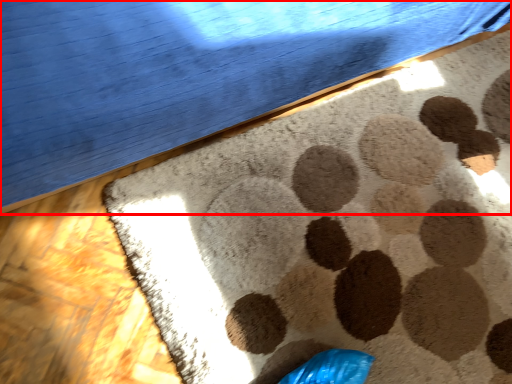
Question: Considering the relative positions of furniture (annotated by the red box) and mat in the image provided, where is furniture (annotated by the red box) located with respect to the staircase?

Choices:
 (A) left
 (B) right

Answer: (A)